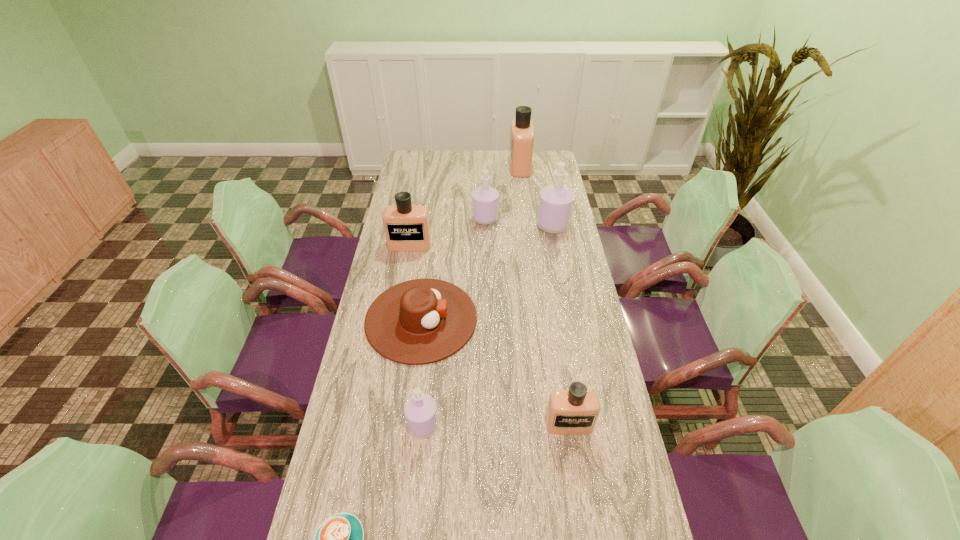
Find the location of `vacant space in between the rightmost purple perfume and the smallest purple perfume`. vacant space in between the rightmost purple perfume and the smallest purple perfume is located at coordinates click(489, 325).

You are a GUI agent. You are given a task and a screenshot of the screen. Output one action in this format:
    pyautogui.click(x=<x>, y=<y>)
    Task: Click on the vacant point located between the cowboy hat and the farthest beige perfume
    This screenshot has height=540, width=960.
    Given the screenshot: What is the action you would take?
    pyautogui.click(x=470, y=242)

What are the coordinates of `vacant point located between the leftmost purple perfume and the cowboy hat` in the screenshot? It's located at (422, 372).

Find the location of `empty space between the cowboy hat and the nearest beige perfume`. empty space between the cowboy hat and the nearest beige perfume is located at coordinates (495, 372).

Locate an element on the screen. This screenshot has width=960, height=540. vacant area that lies between the second biggest beige perfume and the second purple perfume from left to right is located at coordinates (447, 232).

Image resolution: width=960 pixels, height=540 pixels. Identify the location of vacant space in between the biggest purple perfume and the nearest beige perfume. (561, 325).

Find the location of a particular element. This screenshot has width=960, height=540. vacant space that's between the farthest beige perfume and the fifth nearest object is located at coordinates (465, 206).

The height and width of the screenshot is (540, 960). I want to click on free area in between the nearest beige perfume and the second biggest purple perfume, so click(x=527, y=321).

Locate an element on the screen. The image size is (960, 540). object that is the third nearest to the fourth perfume from right to left is located at coordinates (522, 131).

The image size is (960, 540). I want to click on the second closest object to the nearest purple perfume, so click(x=339, y=539).